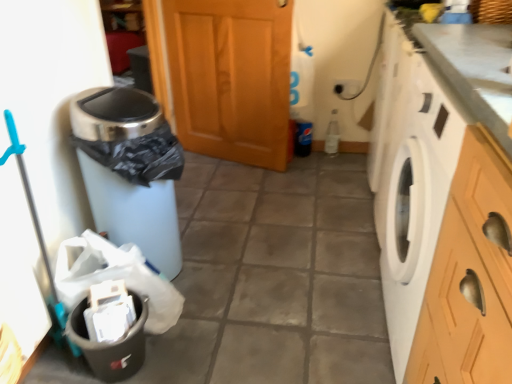
In order to click on vacant area that lies to the right of black plastic trash can at left in this screenshot , I will do `click(228, 308)`.